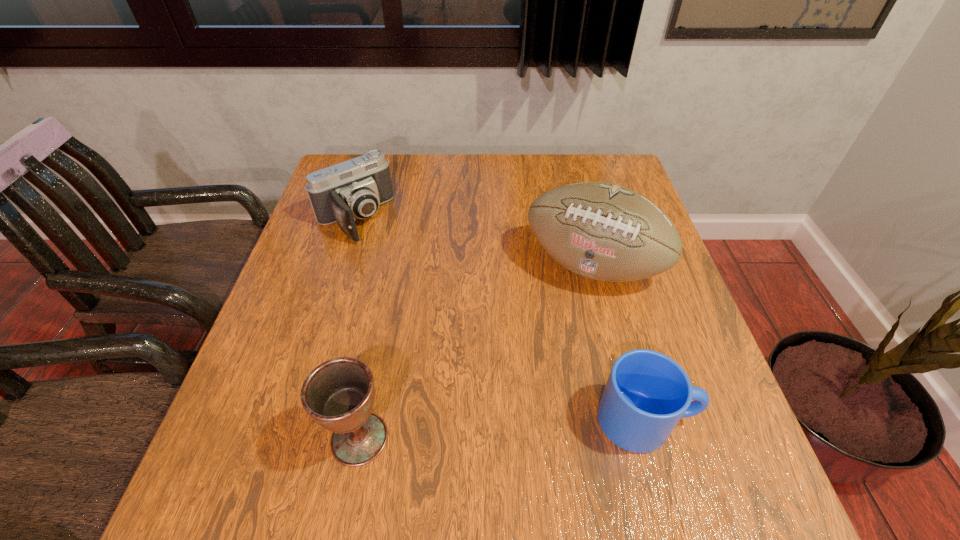
Image resolution: width=960 pixels, height=540 pixels. What are the coordinates of `chalice` in the screenshot? It's located at (339, 394).

The height and width of the screenshot is (540, 960). Identify the location of the shortest object. (647, 393).

The image size is (960, 540). I want to click on the tallest object, so click(x=605, y=232).

I want to click on camera, so click(x=354, y=189).

Image resolution: width=960 pixels, height=540 pixels. What are the coordinates of `free point located 0.090m on the left of the chalice` in the screenshot? It's located at (278, 438).

This screenshot has height=540, width=960. Find the location of `vacant area situated 0.060m on the side of the mug with the handle`. vacant area situated 0.060m on the side of the mug with the handle is located at coordinates (727, 420).

Where is `free space located on the laces of the football (American)`? This screenshot has height=540, width=960. free space located on the laces of the football (American) is located at coordinates (561, 327).

At what (x,y) coordinates should I click in order to perform the action: click on free space located on the laces of the football (American). Please return your answer as a coordinate pair (x, y). This screenshot has width=960, height=540. Looking at the image, I should click on (530, 404).

Image resolution: width=960 pixels, height=540 pixels. Find the location of `free point located 0.160m on the laces of the football (American)`. free point located 0.160m on the laces of the football (American) is located at coordinates (551, 352).

Image resolution: width=960 pixels, height=540 pixels. I want to click on free region located 0.230m at the front of the camera with an open lens cover, so click(414, 293).